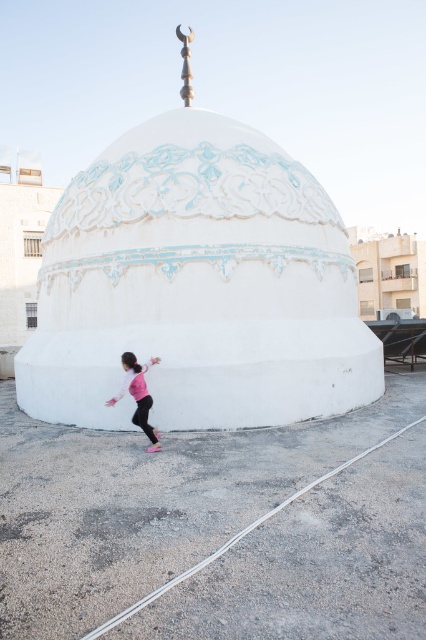
Looking at this image, does white glossy dome at center appear over pink fabric child at lower left?

Correct, white glossy dome at center is located above pink fabric child at lower left.

Measure the distance between white glossy dome at center and camera.

A distance of 8.81 meters exists between white glossy dome at center and camera.

Locate an element on the screen. Image resolution: width=426 pixels, height=640 pixels. white glossy dome at center is located at coordinates (198, 285).